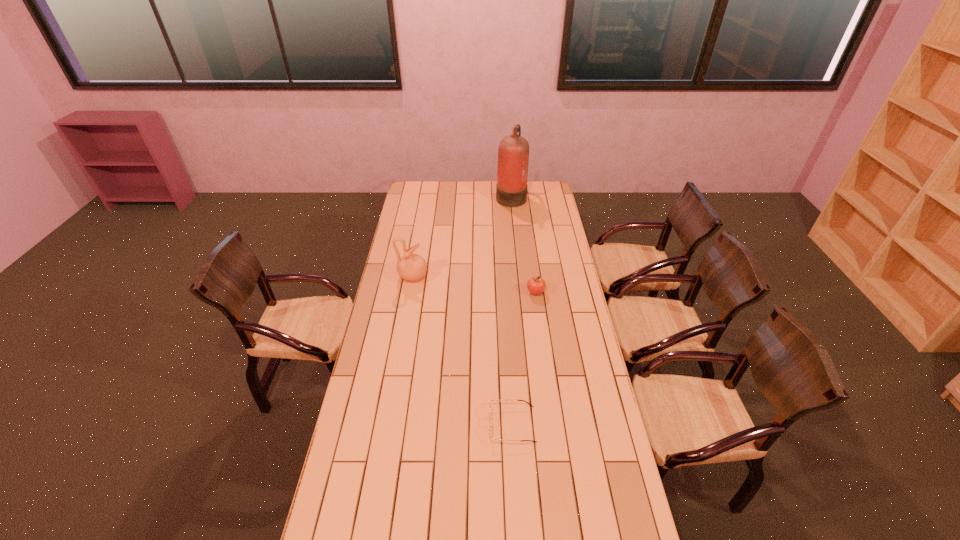
Where is `the farthest object`? the farthest object is located at coordinates (513, 153).

The height and width of the screenshot is (540, 960). In order to click on fire extinguisher in this screenshot , I will do `click(513, 153)`.

I want to click on the leftmost object, so click(x=412, y=267).

Where is `pottery`? pottery is located at coordinates (412, 267).

You are a GUI agent. You are given a task and a screenshot of the screen. Output one action in this format:
    pyautogui.click(x=<x>, y=<y>)
    Task: Click on the apple
    
    Given the screenshot: What is the action you would take?
    pyautogui.click(x=536, y=285)

Identify the location of the shortest object. The height and width of the screenshot is (540, 960). (490, 424).

This screenshot has width=960, height=540. I want to click on spectacles, so click(x=490, y=424).

Locate an element on the screen. The height and width of the screenshot is (540, 960). free space located at the nozzle of the farthest object is located at coordinates (463, 196).

You are a GUI agent. You are given a task and a screenshot of the screen. Output one action in this format:
    pyautogui.click(x=<x>, y=<y>)
    Task: Click on the free spot located 0.130m at the nozzle of the farthest object
    The image size is (960, 540).
    Given the screenshot: What is the action you would take?
    pyautogui.click(x=475, y=196)

Locate an element on the screen. blank space located at the nozzle of the farthest object is located at coordinates (461, 196).